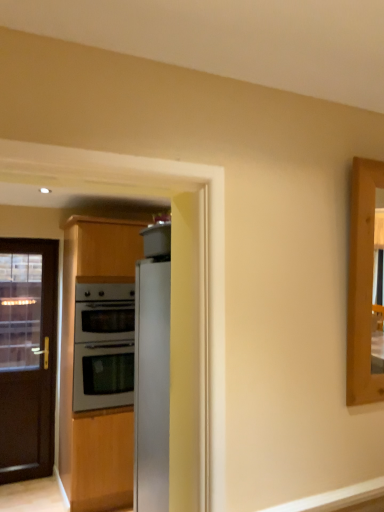
Question: From the image's perspective, is black glass door at left below satin silver oven at center?

Choices:
 (A) no
 (B) yes

Answer: (B)

Question: From a real-world perspective, is black glass door at left under satin silver oven at center?

Choices:
 (A) no
 (B) yes

Answer: (B)

Question: Does black glass door at left have a smaller size compared to satin silver oven at center?

Choices:
 (A) no
 (B) yes

Answer: (B)

Question: Is black glass door at left looking in the opposite direction of satin silver oven at center?

Choices:
 (A) yes
 (B) no

Answer: (B)

Question: Is the position of black glass door at left more distant than that of satin silver oven at center?

Choices:
 (A) no
 (B) yes

Answer: (B)

Question: Considering the relative positions of black glass door at left and satin silver oven at center in the image provided, is black glass door at left to the right of satin silver oven at center from the viewer's perspective?

Choices:
 (A) yes
 (B) no

Answer: (B)

Question: Does satin silver oven at center have a smaller size compared to black glass door at left?

Choices:
 (A) no
 (B) yes

Answer: (A)

Question: Is satin silver oven at center positioned behind black glass door at left?

Choices:
 (A) yes
 (B) no

Answer: (B)

Question: Is satin silver oven at center to the right of black glass door at left from the viewer's perspective?

Choices:
 (A) yes
 (B) no

Answer: (A)

Question: Is satin silver oven at center thinner than black glass door at left?

Choices:
 (A) no
 (B) yes

Answer: (A)

Question: Is satin silver oven at center not close to black glass door at left?

Choices:
 (A) yes
 (B) no

Answer: (B)

Question: Is satin silver oven at center not inside black glass door at left?

Choices:
 (A) no
 (B) yes

Answer: (B)

Question: Is the depth of satin silver oven at center less than that of sleek metallic refrigerator at center?

Choices:
 (A) yes
 (B) no

Answer: (B)